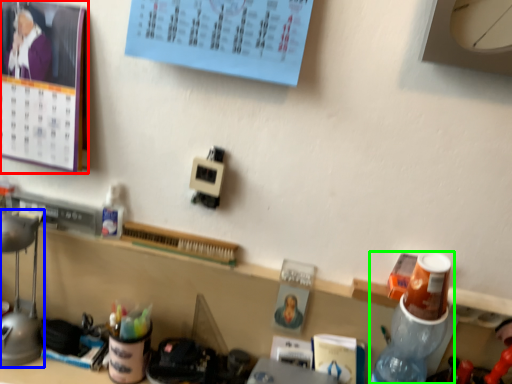
Question: Which object is positioned closest to bulletin board (highlighted by a red box)? Select from lamp (highlighted by a blue box) and bottle (highlighted by a green box).

Choices:
 (A) lamp
 (B) bottle

Answer: (A)